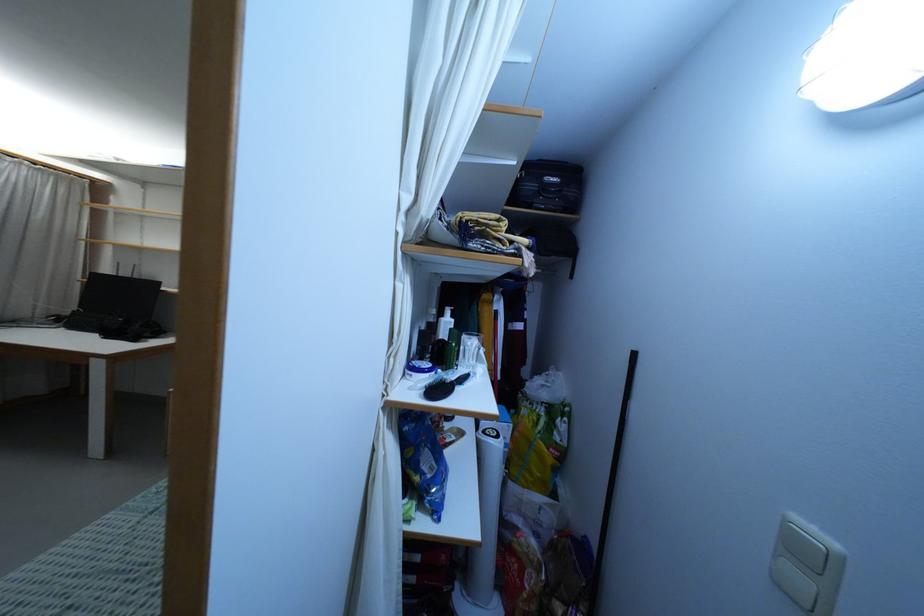
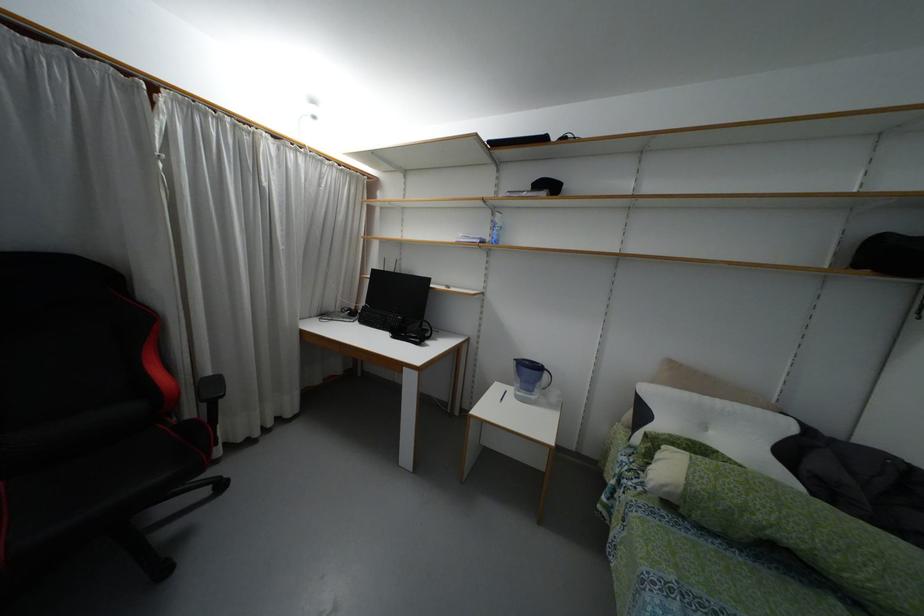
Question: In a continuous first-person perspective shot, in which direction is the camera moving?

Choices:
 (A) Left
 (B) Right
 (C) Forward
 (D) Backward

Answer: (A)